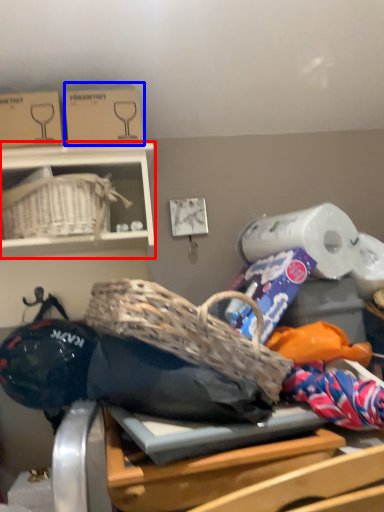
Question: Among these objects, which one is nearest to the camera, furniture (highlighted by a red box) or cardboard box (highlighted by a blue box)?

Choices:
 (A) furniture
 (B) cardboard box

Answer: (A)